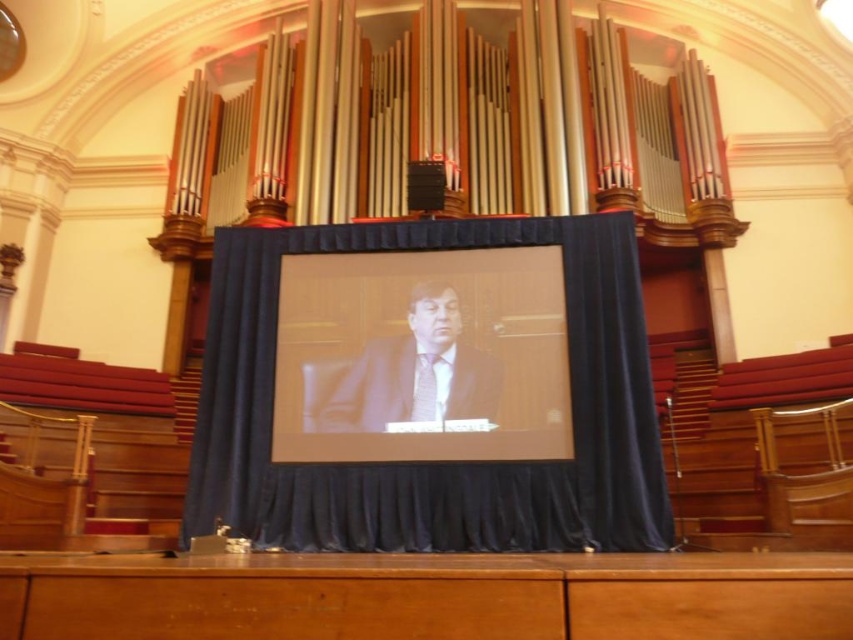
Is matte black screen at center shorter than matte suit at center?

No.

Does point (480, 328) come behind point (438, 349)?

Yes, it is.

Is point (515, 426) positioned before point (433, 346)?

Yes.

Find the location of `matte black screen at center`. matte black screen at center is located at coordinates (422, 356).

Does point (566, 515) come farther from viewer compared to point (403, 348)?

No, it is in front of (403, 348).

Between velvet blue curtain at center and matte black screen at center, which one appears on the left side from the viewer's perspective?

matte black screen at center

Where is `velvet blue curtain at center`? velvet blue curtain at center is located at coordinates (432, 470).

Which is below, velvet blue curtain at center or matte suit at center?

matte suit at center is lower down.

Looking at this image, does velvet blue curtain at center have a greater width compared to matte suit at center?

Yes.

Between point (416, 529) and point (490, 404), which one is positioned behind?

The point (490, 404) is more distant.

Locate an element on the screen. velvet blue curtain at center is located at coordinates (432, 470).